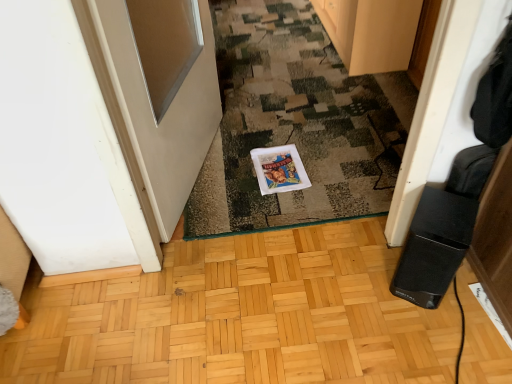
Locate an element on the screen. This screenshot has width=512, height=384. vacant space that is to the left of black plastic speaker at lower right is located at coordinates (366, 287).